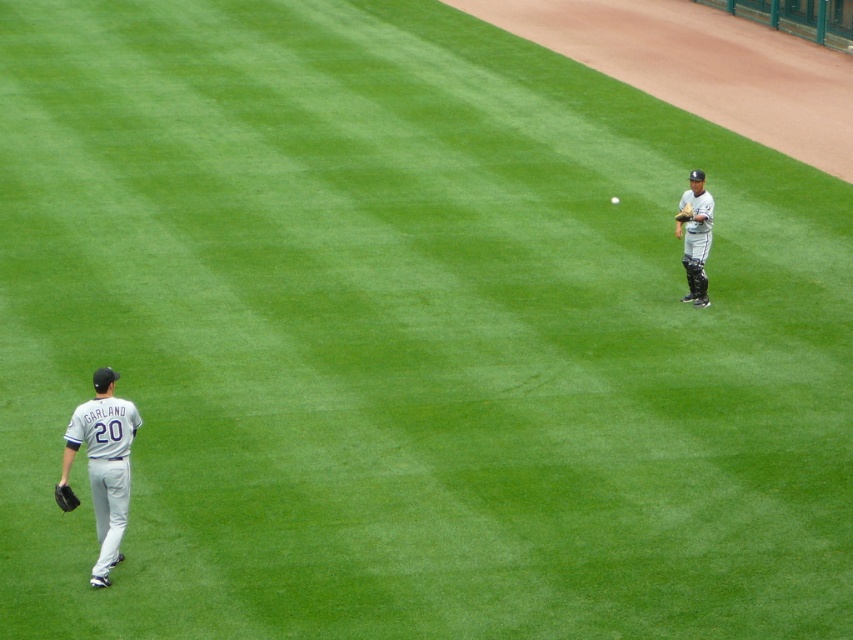
From the picture: Which is more to the right, gray uniformed catcher at upper right or dark gray leather glove at upper right?

gray uniformed catcher at upper right

Between gray uniformed catcher at upper right and dark gray leather glove at upper right, which one has more height?

gray uniformed catcher at upper right

Is point (688, 268) in front of point (686, 220)?

No, it is behind (686, 220).

Identify the location of gray uniformed catcher at upper right. (695, 236).

Which is behind, point (125, 444) or point (614, 204)?

The point (614, 204) is behind.

Is gray fabric uniform at lower left above white matte baseball at center?

No, gray fabric uniform at lower left is not above white matte baseball at center.

The width and height of the screenshot is (853, 640). Find the location of `gray fabric uniform at lower left`. gray fabric uniform at lower left is located at coordinates (103, 465).

Does gray fabric uniform at lower left have a larger size compared to gray uniformed catcher at upper right?

Incorrect, gray fabric uniform at lower left is not larger than gray uniformed catcher at upper right.

In the scene shown: Which is below, gray fabric uniform at lower left or gray uniformed catcher at upper right?

Positioned lower is gray fabric uniform at lower left.

This screenshot has width=853, height=640. Find the location of `gray fabric uniform at lower left`. gray fabric uniform at lower left is located at coordinates (103, 465).